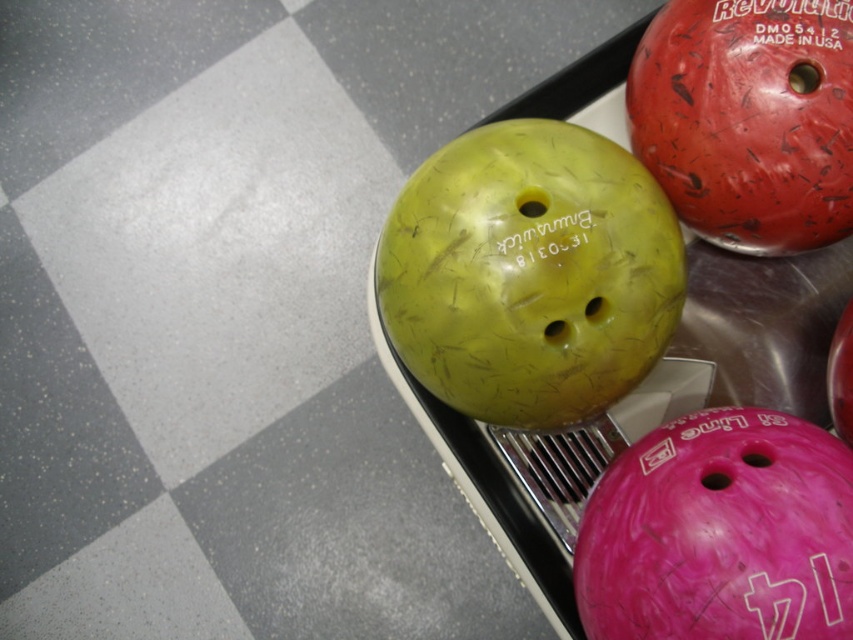
Between yellow-green textured bowling ball at center and red textured bowling ball at upper right, which one is positioned higher?

red textured bowling ball at upper right is higher up.

Is yellow-green textured bowling ball at center to the right of red textured bowling ball at upper right from the viewer's perspective?

No, yellow-green textured bowling ball at center is not to the right of red textured bowling ball at upper right.

Which is behind, point (633, 364) or point (848, 8)?

The point (633, 364) is more distant.

What are the coordinates of `yellow-green textured bowling ball at center` in the screenshot? It's located at (529, 273).

Can you confirm if yellow-green textured bowling ball at center is shorter than pink textured bowling ball at center?

No, yellow-green textured bowling ball at center is not shorter than pink textured bowling ball at center.

Can you confirm if yellow-green textured bowling ball at center is positioned to the left of pink textured bowling ball at center?

Indeed, yellow-green textured bowling ball at center is positioned on the left side of pink textured bowling ball at center.

Who is more forward, (561, 241) or (782, 616)?

Point (782, 616) is more forward.

This screenshot has width=853, height=640. Identify the location of yellow-green textured bowling ball at center. (529, 273).

Between pink textured bowling ball at center and red textured bowling ball at upper right, which one appears on the left side from the viewer's perspective?

Positioned to the left is pink textured bowling ball at center.

Is point (589, 513) behind point (815, 161)?

No, it is not.

Find the location of `pink textured bowling ball at center`. pink textured bowling ball at center is located at coordinates (720, 532).